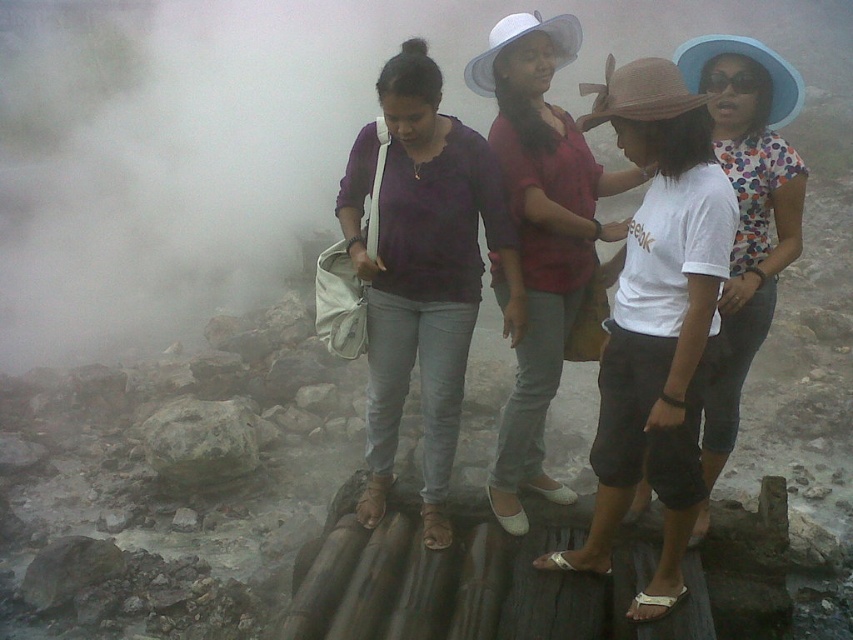
Question: Is white matte shirt at center positioned behind white cotton shirt at center?

Choices:
 (A) yes
 (B) no

Answer: (B)

Question: Does white mist at foggy center have a lesser width compared to white matte shirt at center?

Choices:
 (A) no
 (B) yes

Answer: (A)

Question: Is the position of white mist at foggy center less distant than that of white cotton shirt at center?

Choices:
 (A) no
 (B) yes

Answer: (A)

Question: Which object is positioned closest to the white cotton shirt at center?

Choices:
 (A) white matte shirt at center
 (B) gray rough rock at center
 (C) matte purple blouse at center

Answer: (A)

Question: Which object appears farthest from the camera in this image?

Choices:
 (A) white matte shirt at center
 (B) matte white hat at center
 (C) white mist at foggy center
 (D) matte purple blouse at center

Answer: (C)

Question: Which object is closer to the camera taking this photo?

Choices:
 (A) white matte shirt at center
 (B) matte purple blouse at center

Answer: (A)